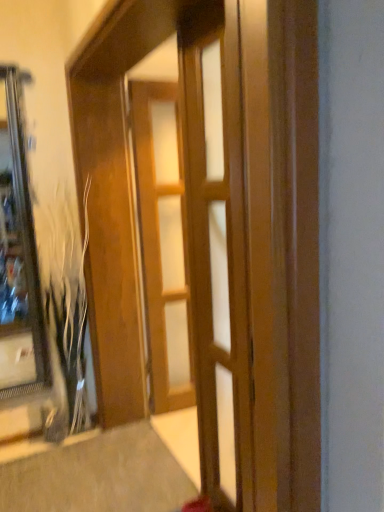
Question: Is wooden barn door at center not inside wooden door at center, which ranks as the 1th door in back-to-front order?

Choices:
 (A) yes
 (B) no

Answer: (A)

Question: Considering the relative positions of wooden barn door at center and wooden door at center, which is the 2th door from front to back, in the image provided, is wooden barn door at center to the left of wooden door at center, which is the 2th door from front to back, from the viewer's perspective?

Choices:
 (A) no
 (B) yes

Answer: (B)

Question: From the image's perspective, is wooden barn door at center under wooden door at center, which ranks as the 1th door in back-to-front order?

Choices:
 (A) yes
 (B) no

Answer: (A)

Question: From the image's perspective, is wooden barn door at center above wooden door at center, which ranks as the 1th door in back-to-front order?

Choices:
 (A) no
 (B) yes

Answer: (A)

Question: Would you say wooden barn door at center is a long distance from wooden door at center, which ranks as the 1th door in back-to-front order?

Choices:
 (A) yes
 (B) no

Answer: (B)

Question: Is point (205, 164) closer or farther from the camera than point (177, 276)?

Choices:
 (A) closer
 (B) farther

Answer: (A)

Question: Is wooden door at center, which appears as the 1th door when viewed from the front, in front of or behind wooden door at center, which is the 2th door from front to back, in the image?

Choices:
 (A) front
 (B) behind

Answer: (A)

Question: Is wooden door at center, which appears as the 1th door when viewed from the front, bigger or smaller than wooden door at center, which is the 2th door from front to back?

Choices:
 (A) small
 (B) big

Answer: (A)

Question: From their relative heights in the image, would you say wooden door at center, which appears as the 2th door when viewed from the back, is taller or shorter than wooden door at center, which is the 2th door from front to back?

Choices:
 (A) tall
 (B) short

Answer: (B)

Question: From a real-world perspective, is wooden barn door at center above or below wooden door at center, which is the 2th door from front to back?

Choices:
 (A) above
 (B) below

Answer: (A)

Question: In the image, is wooden barn door at center positioned in front of or behind wooden door at center, which ranks as the 1th door in back-to-front order?

Choices:
 (A) front
 (B) behind

Answer: (A)

Question: Considering the positions of wooden barn door at center and wooden door at center, which ranks as the 1th door in back-to-front order, in the image, is wooden barn door at center taller or shorter than wooden door at center, which ranks as the 1th door in back-to-front order,?

Choices:
 (A) tall
 (B) short

Answer: (A)

Question: From the image's perspective, is wooden barn door at center above or below wooden door at center, which ranks as the 1th door in back-to-front order?

Choices:
 (A) above
 (B) below

Answer: (B)

Question: Is wooden barn door at center wider or thinner than wooden door at center, which appears as the 1th door when viewed from the front?

Choices:
 (A) thin
 (B) wide

Answer: (B)

Question: From a real-world perspective, is wooden barn door at center positioned above or below wooden door at center, which appears as the 2th door when viewed from the back?

Choices:
 (A) below
 (B) above

Answer: (A)